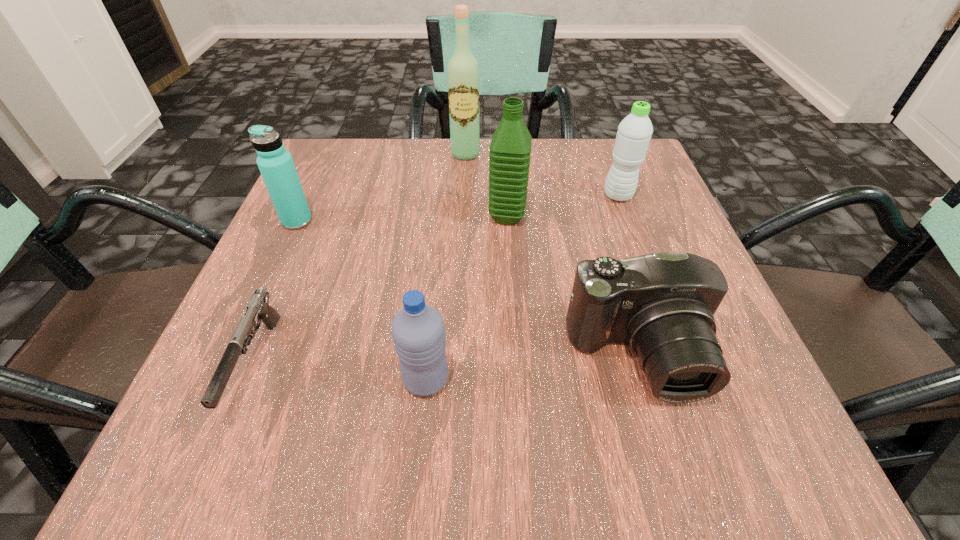
Choose which water bottle is the nearest neighbor to the second shortest object. Please provide its 2D coordinates. Your answer should be formatted as a tuple, i.e. [(x, y)], where the tuple contains the x and y coordinates of a point satisfying the conditions above.

[(418, 331)]

Where is `water bottle that is the closest to the second shortest object`? water bottle that is the closest to the second shortest object is located at coordinates (418, 331).

The height and width of the screenshot is (540, 960). What are the coordinates of `free region that satisfies the following two spatial constraints: 1. on the back side of the tallest water bottle; 2. on the left side of the leftmost water bottle` in the screenshot? It's located at (299, 217).